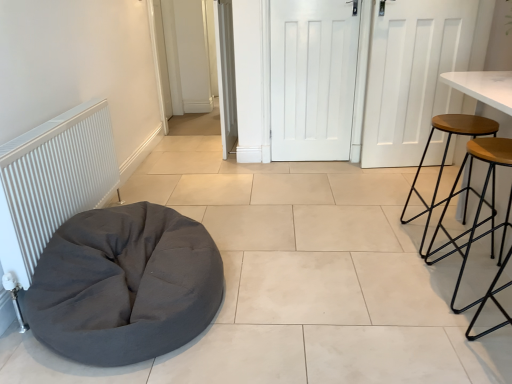
Locate an element on the screen. The width and height of the screenshot is (512, 384). vacant space to the right of white matte door at center, positioned as the second door in right-to-left order is located at coordinates (350, 166).